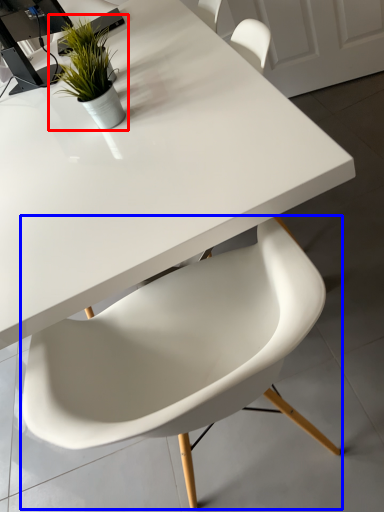
Question: Among these objects, which one is farthest to the camera, houseplant (highlighted by a red box) or chair (highlighted by a blue box)?

Choices:
 (A) houseplant
 (B) chair

Answer: (A)